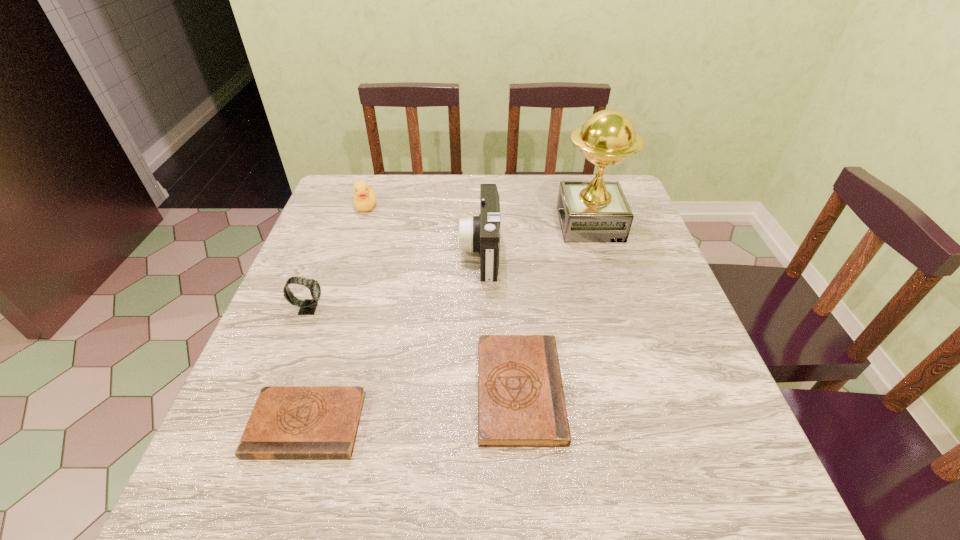
Image resolution: width=960 pixels, height=540 pixels. I want to click on unoccupied position between the rightmost object and the shortest object, so click(448, 324).

Identify the location of vacant area that lies between the second tallest object and the duckling. The height and width of the screenshot is (540, 960). (423, 229).

Identify which object is the fifth nearest to the left diary. Please provide its 2D coordinates. Your answer should be formatted as a tuple, i.e. [(x, y)], where the tuple contains the x and y coordinates of a point satisfying the conditions above.

[(597, 211)]

Locate which object is the second closest to the taller diary. Please provide its 2D coordinates. Your answer should be formatted as a tuple, i.e. [(x, y)], where the tuple contains the x and y coordinates of a point satisfying the conditions above.

[(287, 422)]

Identify the location of free point that satisfies the following two spatial constraints: 1. on the lens of the fifth shortest object; 2. on the spine side of the shorter diary. The image size is (960, 540). (481, 424).

Locate an element on the screen. This screenshot has width=960, height=540. free space that satisfies the following two spatial constraints: 1. on the front-facing side of the award; 2. on the spine side of the shorter diary is located at coordinates (651, 424).

Identify the location of free space that satisfies the following two spatial constraints: 1. on the lens of the camcorder; 2. on the spine side of the shortest object. (481, 424).

This screenshot has width=960, height=540. Identify the location of free space that satisfies the following two spatial constraints: 1. on the spine side of the taller diary; 2. on the spine side of the left diary. (522, 424).